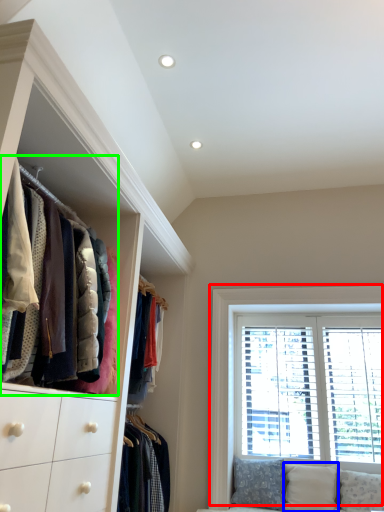
Question: Which is nearer to the window (highlighted by a red box)? pillow (highlighted by a blue box) or closet (highlighted by a green box).

Choices:
 (A) pillow
 (B) closet

Answer: (A)